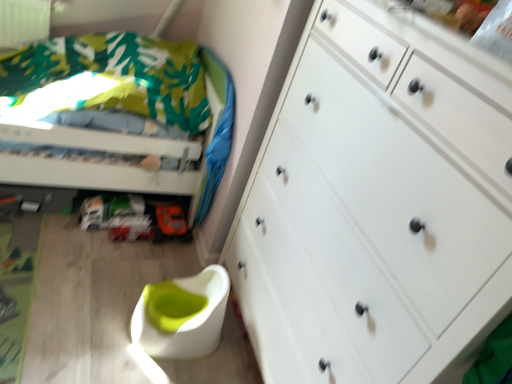
Question: Is white matte chest of drawers at right at the back of white plastic swivel chair at lower center?

Choices:
 (A) yes
 (B) no

Answer: (A)

Question: Would you say white plastic swivel chair at lower center contains white matte chest of drawers at right?

Choices:
 (A) no
 (B) yes

Answer: (A)

Question: Can you confirm if white plastic swivel chair at lower center is thinner than white matte chest of drawers at right?

Choices:
 (A) no
 (B) yes

Answer: (B)

Question: Does white plastic swivel chair at lower center lie in front of white matte chest of drawers at right?

Choices:
 (A) yes
 (B) no

Answer: (B)

Question: Considering the relative sizes of white plastic swivel chair at lower center and white matte chest of drawers at right in the image provided, is white plastic swivel chair at lower center wider than white matte chest of drawers at right?

Choices:
 (A) yes
 (B) no

Answer: (B)

Question: Is white plastic swivel chair at lower center aimed at white matte chest of drawers at right?

Choices:
 (A) no
 (B) yes

Answer: (A)

Question: Does green fabric bed at upper left turn towards orange matte toy car at lower center?

Choices:
 (A) no
 (B) yes

Answer: (A)

Question: Is green fabric bed at upper left outside orange matte toy car at lower center?

Choices:
 (A) no
 (B) yes

Answer: (B)

Question: Is orange matte toy car at lower center located within green fabric bed at upper left?

Choices:
 (A) no
 (B) yes

Answer: (B)

Question: Considering the relative sizes of green fabric bed at upper left and orange matte toy car at lower center in the image provided, is green fabric bed at upper left shorter than orange matte toy car at lower center?

Choices:
 (A) yes
 (B) no

Answer: (B)

Question: Does green fabric bed at upper left come in front of orange matte toy car at lower center?

Choices:
 (A) yes
 (B) no

Answer: (A)

Question: Does green fabric bed at upper left lie behind orange matte toy car at lower center?

Choices:
 (A) no
 (B) yes

Answer: (A)

Question: From a real-world perspective, is white matte chest of drawers at right physically below white plastic swivel chair at lower center?

Choices:
 (A) no
 (B) yes

Answer: (A)